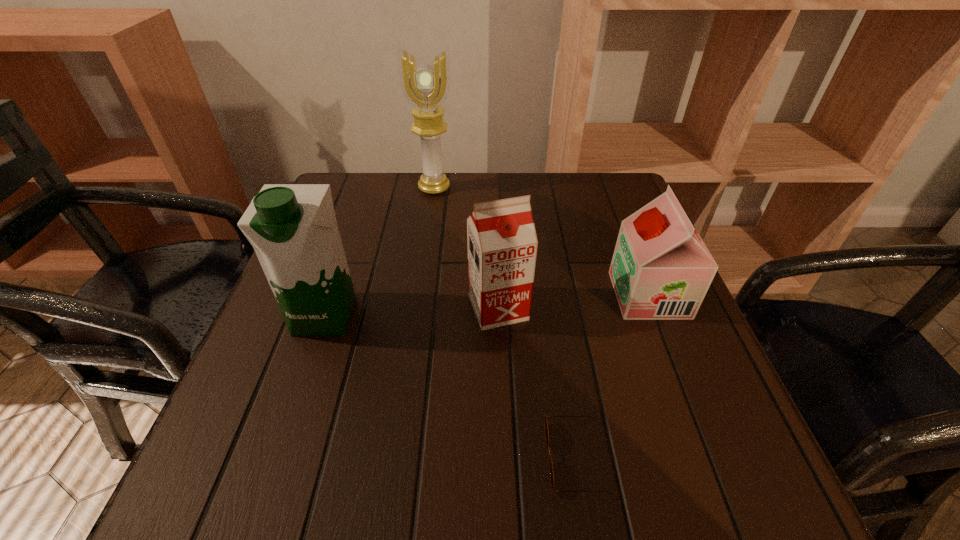
Where is `blank region between the leftmost soya milk and the second soya milk from left to right`? blank region between the leftmost soya milk and the second soya milk from left to right is located at coordinates (412, 312).

Identify the location of vacant space that is in between the award and the second shortest object. The width and height of the screenshot is (960, 540). (541, 241).

Image resolution: width=960 pixels, height=540 pixels. In order to click on free spot between the rightmost soya milk and the fourth object from left to right in this screenshot , I will do `click(612, 376)`.

At what (x,y) coordinates should I click in order to perform the action: click on free area in between the leftmost object and the sunglasses. Please return your answer as a coordinate pair (x, y). The width and height of the screenshot is (960, 540). Looking at the image, I should click on pos(450,386).

Locate an element on the screen. This screenshot has height=540, width=960. free space between the third object from right to left and the sunglasses is located at coordinates (537, 382).

Where is `free point between the second soya milk from right to left and the nearest object`? free point between the second soya milk from right to left and the nearest object is located at coordinates (537, 382).

This screenshot has height=540, width=960. In order to click on free point between the rightmost object and the tallest object in this screenshot , I will do `click(541, 241)`.

You are a GUI agent. You are given a task and a screenshot of the screen. Output one action in this format:
    pyautogui.click(x=<x>, y=<y>)
    Task: Click on the free space between the tallest object and the leftmost object
    
    Given the screenshot: What is the action you would take?
    pyautogui.click(x=379, y=252)

At what (x,y) coordinates should I click in order to perform the action: click on object that can be found as the third closest to the tallest object. Please return your answer as a coordinate pair (x, y). Looking at the image, I should click on (661, 269).

Locate an element on the screen. This screenshot has height=540, width=960. object that ranks as the third closest to the nearest object is located at coordinates (293, 229).